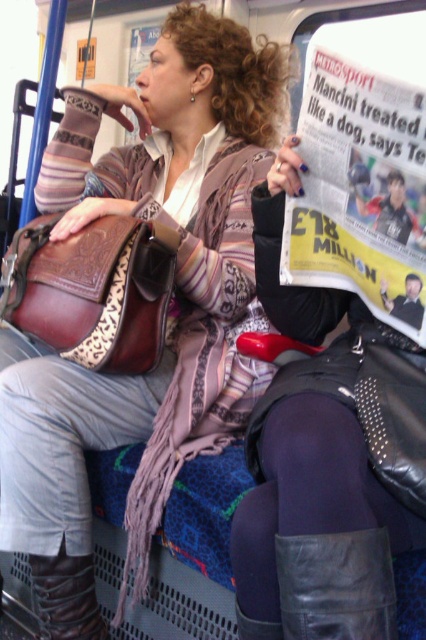
How far apart are leather bag at center and leather boot at lower left?

They are 19.26 inches apart.

Does leather bag at center appear under leather boot at lower left?

No, leather bag at center is not below leather boot at lower left.

At what (x,y) coordinates should I click in order to perform the action: click on leather bag at center. Please return your answer as a coordinate pair (x, y). The width and height of the screenshot is (426, 640). Looking at the image, I should click on (175, 284).

Looking at this image, between leather bag at center and leather boot at lower center, which one appears on the right side from the viewer's perspective?

leather boot at lower center

Based on the photo, does leather bag at center appear under leather boot at lower center?

No, leather bag at center is not below leather boot at lower center.

Which is behind, point (209, 282) or point (314, 586)?

The point (209, 282) is behind.

Where is `leather bag at center`? This screenshot has height=640, width=426. leather bag at center is located at coordinates (175, 284).

Consider the image. Is leather boot at lower center above leather boot at lower left?

Correct, leather boot at lower center is located above leather boot at lower left.

Is point (337, 557) positioned behind point (69, 593)?

No, it is not.

Who is more distant from viewer, (367, 598) or (63, 592)?

Positioned behind is point (63, 592).

In order to click on leather boot at lower center in this screenshot , I will do 336,586.